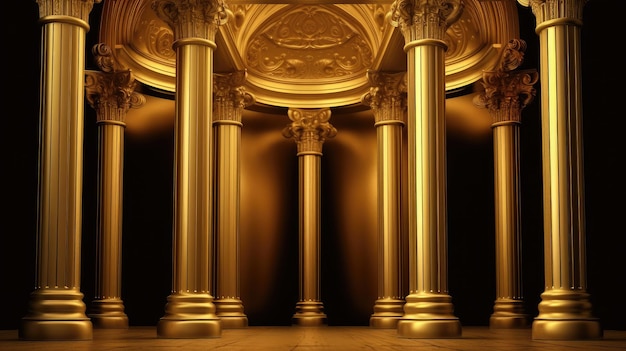
Locate instances of where wall meets floor in the image. Your answer should be formatted as a list of tuples, i.e. [(x1, y1), (x2, y2), ...], where each tuple contains the x and y coordinates of a point satisfying the conditions above.

[(351, 319), (275, 321)]